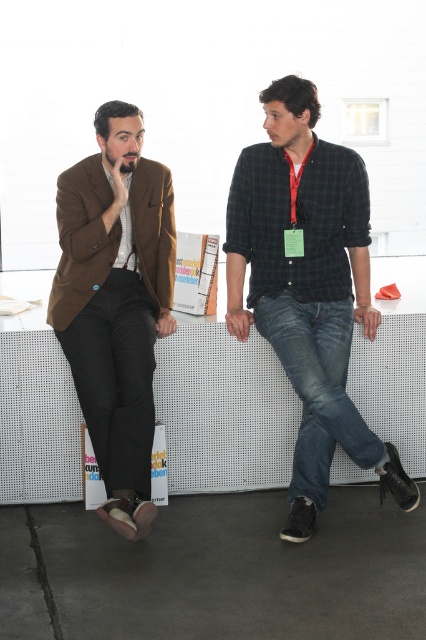
Question: Does matte brown blazer at left have a greater width compared to denim jeans at center?

Choices:
 (A) no
 (B) yes

Answer: (B)

Question: Where is green plaid shirt at center located in relation to matte brown blazer at left in the image?

Choices:
 (A) right
 (B) left

Answer: (A)

Question: Among these objects, which one is farthest from the camera?

Choices:
 (A) denim jeans at center
 (B) green plaid shirt at center
 (C) matte brown blazer at left

Answer: (A)

Question: In this image, where is matte brown blazer at left located relative to denim jeans at center?

Choices:
 (A) below
 (B) above

Answer: (B)

Question: Which of the following is the farthest from the observer?

Choices:
 (A) green plaid shirt at center
 (B) matte brown blazer at left
 (C) denim jeans at center

Answer: (C)

Question: Which point is farther to the camera?

Choices:
 (A) green plaid shirt at center
 (B) matte brown blazer at left
 (C) denim jeans at center

Answer: (C)